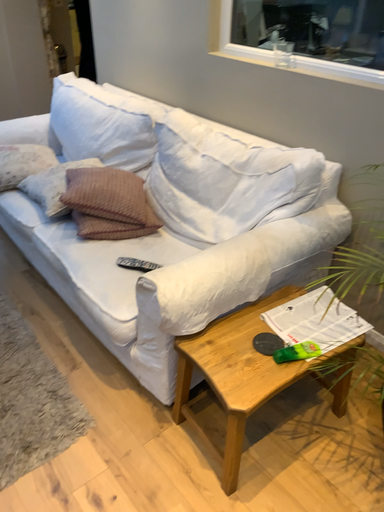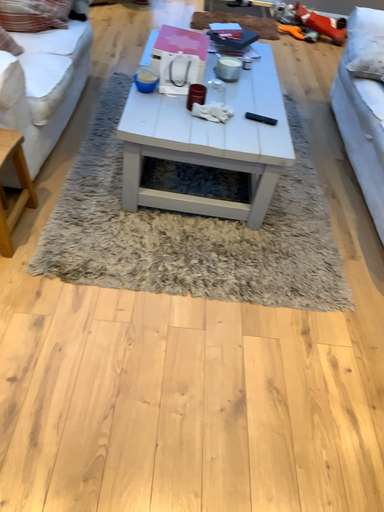
Question: Which way did the camera rotate in the video?

Choices:
 (A) rotated right
 (B) rotated left

Answer: (B)